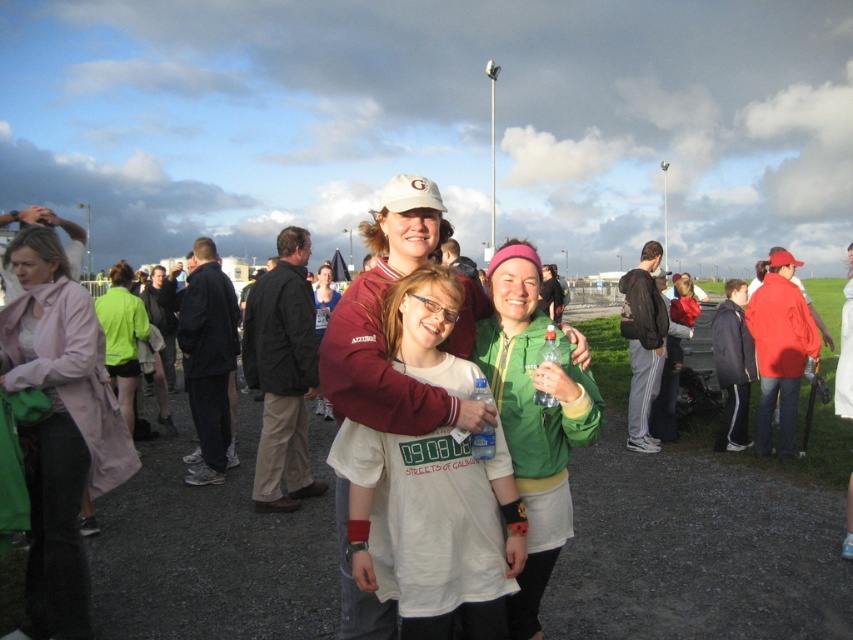
In the image of the lively outdoor community event, there are three people posing. The person on the left wears a white T shirt with printed design and wristbands, the middle person wears a maroon jacket over a white shirt, and the right person wears a green jacket with pink. The white cotton t shirt at center is represented by point (432, 534). Which person is wearing the white cotton t shirt at center?

The white cotton t shirt at center is worn by the middle person, as the point (432, 534) corresponds to their location in the image.